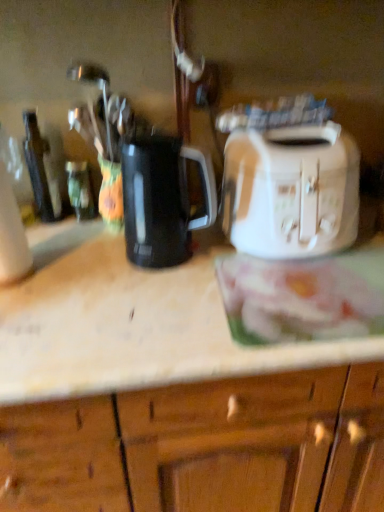
Find the location of a particular element. The height and width of the screenshot is (512, 384). vacant area situated to the left side of black plastic kettle at center is located at coordinates (78, 271).